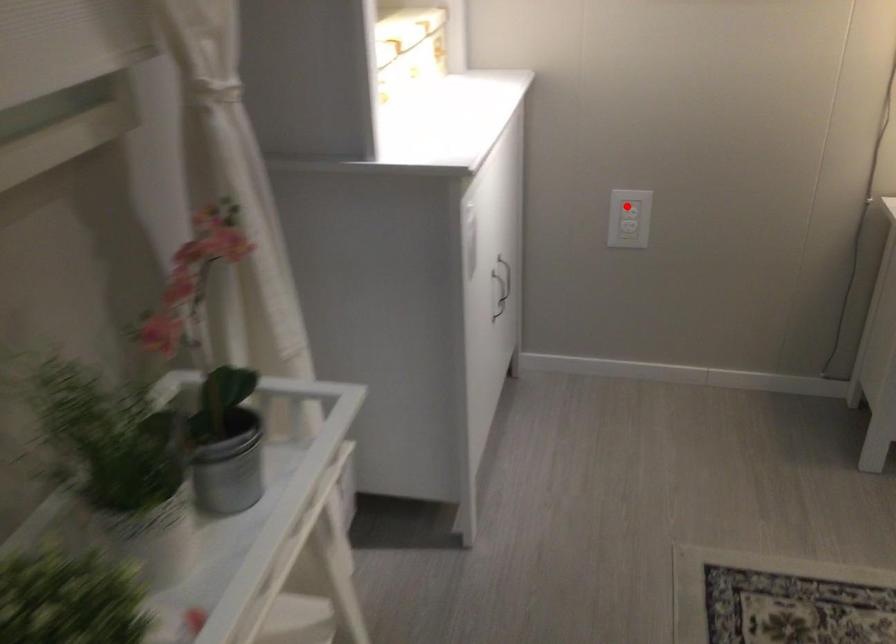
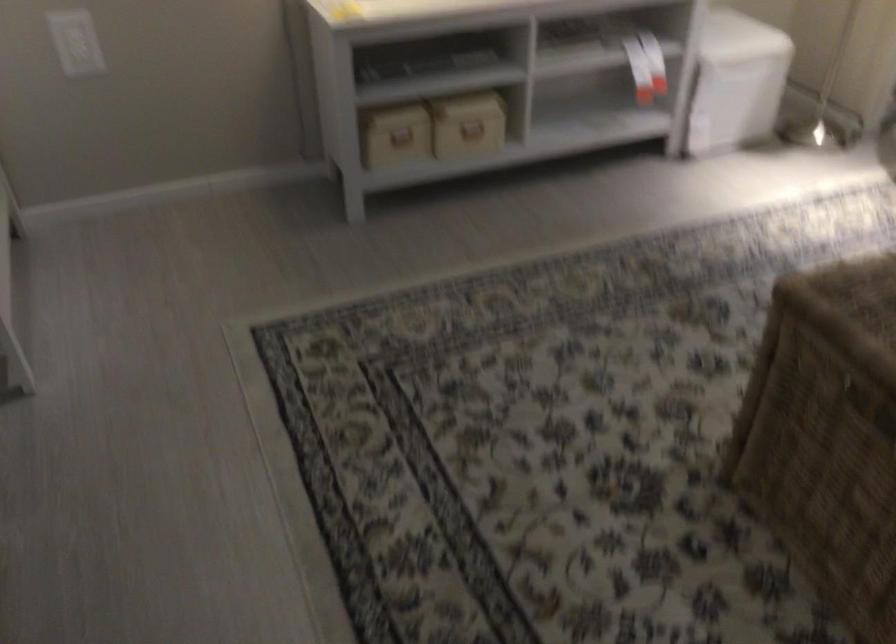
Locate, in the second image, the point that corresponds to the highlighted location in the first image.

(75, 42)